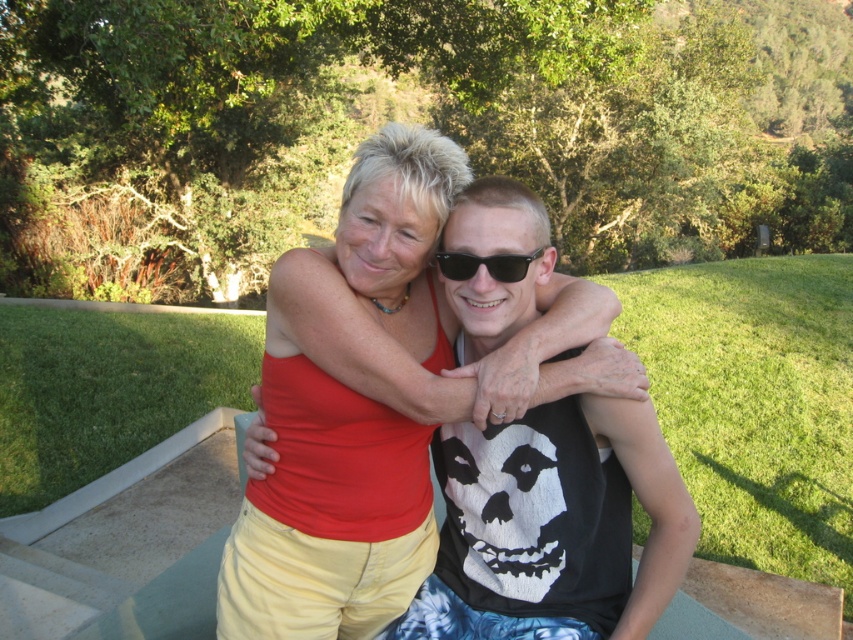
You are standing in a park and see the matte red tank top at center. If you want to take a photo of it with your phone, which has a minimum focus distance of 2 feet, will you need to move closer or farther away?

The matte red tank top at center is 5.40 feet away from you. Since your phone requires a minimum focus distance of 2 feet, you do not need to move closer. You can take the photo from your current position.

You are a photographer trying to capture a closeup shot of the matte red tank top at center and the black plastic sunglasses at center. Which object should you focus on first if you want to ensure both are in focus, given their positions?

The matte red tank top at center is positioned on the left side of black plastic sunglasses at center. Since they are both at the same distance from the camera, focusing on either one will keep both in focus.

You are a photographer trying to focus on the matte red tank top at center and the black plastic sunglasses at center. Which object should you adjust your camera to focus on first if you want to capture both clearly in the same shot?

The matte red tank top at center is in front of the black plastic sunglasses at center, so you should focus on the matte red tank top at center first to ensure both are in focus.